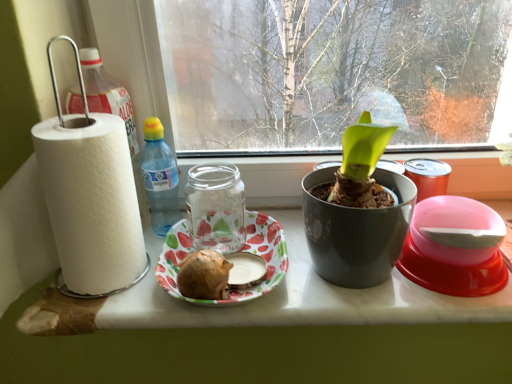
Locate an element on the screen. Image resolution: width=512 pixels, height=384 pixels. free spot behind brown matte potato at center is located at coordinates (232, 234).